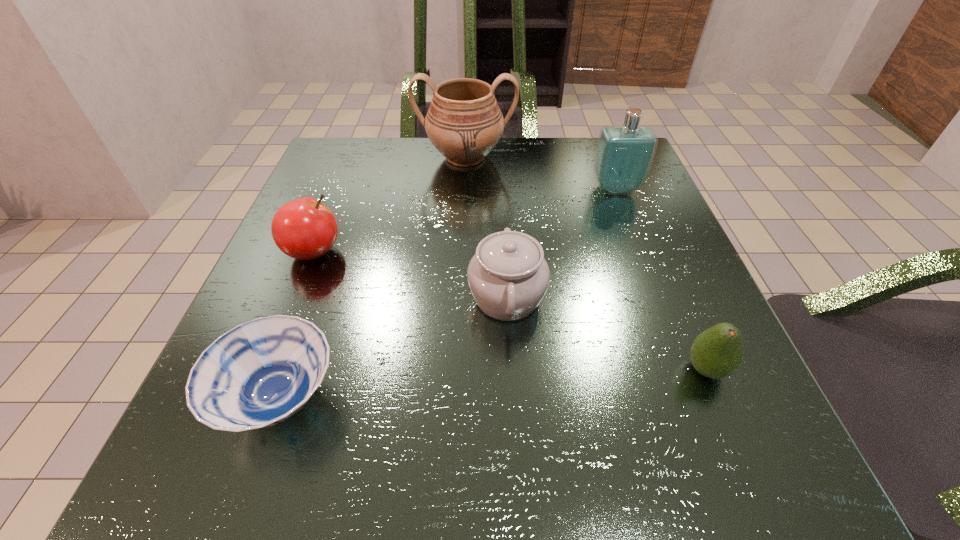
Identify the location of the farthest object. The width and height of the screenshot is (960, 540). (464, 122).

Locate an element on the screen. perfume is located at coordinates (624, 155).

What are the coordinates of `chinaware` in the screenshot? It's located at (508, 276).

Image resolution: width=960 pixels, height=540 pixels. Identify the location of apple. (304, 228).

Where is `avocado`? The image size is (960, 540). avocado is located at coordinates (717, 352).

You are a GUI agent. You are given a task and a screenshot of the screen. Output one action in this format:
    pyautogui.click(x=<x>, y=<y>)
    Task: Click on the shortest object
    This screenshot has width=960, height=540.
    Given the screenshot: What is the action you would take?
    pyautogui.click(x=260, y=373)

Find the location of `vacant space located 0.120m on the front-facing side of the urn`. vacant space located 0.120m on the front-facing side of the urn is located at coordinates (463, 211).

The image size is (960, 540). What are the coordinates of `free spot located on the front label of the perfume` in the screenshot? It's located at (640, 253).

Locate an element on the screen. free location located on the front of the chinaware is located at coordinates (516, 462).

Find the location of `vacant space located 0.220m on the front of the apple`. vacant space located 0.220m on the front of the apple is located at coordinates (259, 387).